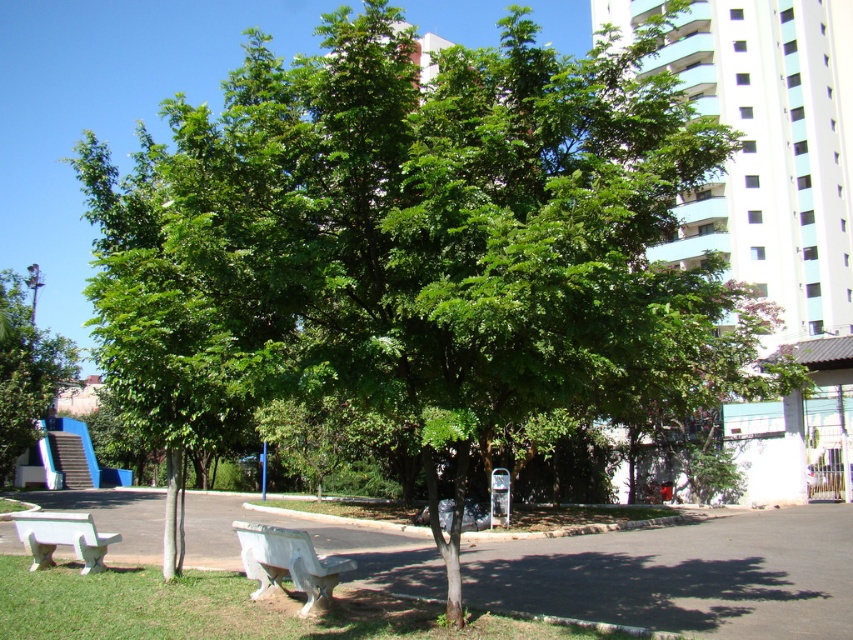
Question: Does green leafy tree at left have a smaller size compared to white concrete bench at lower center?

Choices:
 (A) yes
 (B) no

Answer: (B)

Question: Which object is the closest to the white plastic bench at lower left?

Choices:
 (A) white concrete bench at lower center
 (B) green leafy tree at left

Answer: (A)

Question: Can you confirm if white concrete bench at lower center is wider than white plastic bench at lower left?

Choices:
 (A) yes
 (B) no

Answer: (B)

Question: Considering the real-world distances, which object is farthest from the white concrete bench at lower center?

Choices:
 (A) white plastic bench at lower left
 (B) green leafy tree at left

Answer: (B)

Question: Does white concrete bench at lower center appear on the left side of white plastic bench at lower left?

Choices:
 (A) no
 (B) yes

Answer: (A)

Question: Which object appears farthest from the camera in this image?

Choices:
 (A) white concrete bench at lower center
 (B) green leafy tree at left
 (C) white plastic bench at lower left

Answer: (B)